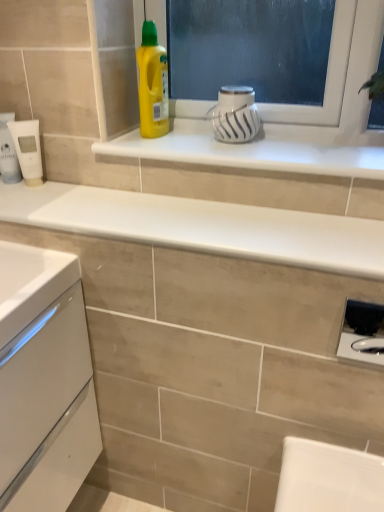
I want to click on vacant space to the left of white glossy mug at upper center, acting as the third appliance starting from the bottom, so click(174, 140).